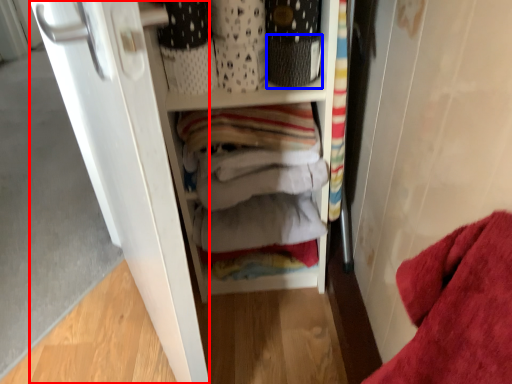
Question: Which of the following is the farthest to the observer, door (highlighted by a red box) or basket (highlighted by a blue box)?

Choices:
 (A) door
 (B) basket

Answer: (B)